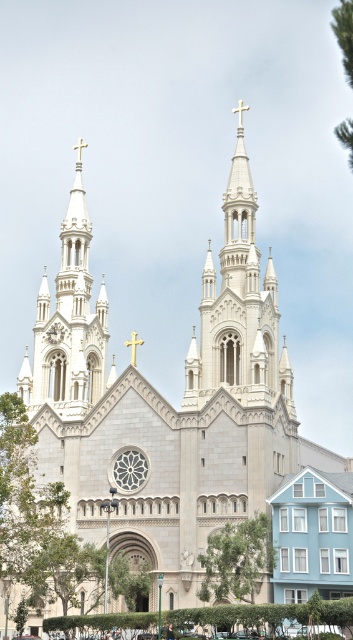
You are standing at the entrance of the grand church and want to find the green leafy tree at lower left. According to the coordinates, where should you look relative to your position?

The green leafy tree at lower left is located at coordinates point (48, 531), which means it is positioned to the lower left relative to your current position at the entrance of the church.

You are standing in front of the grand church and want to take a photo that includes both the green leafy tree at center and the green leafy tree at upper right. Based on their distances from each other, do you think you can fit both trees in the frame of your camera?

The green leafy tree at center is 66.47 meters away from the green leafy tree at upper right. Since they are quite far apart, you might need to use a wide angle lens to capture both trees in the same frame.

In the scene shown: You are standing in front of the grand church and want to take a photo that includes both the green leafy tree at lower left and the central spire of the church. Based on their positions, will the tree be to the left or right of the spire in the photo?

The green leafy tree at lower left is located at point (48, 531), which places it to the left side of the central spire in the photo.